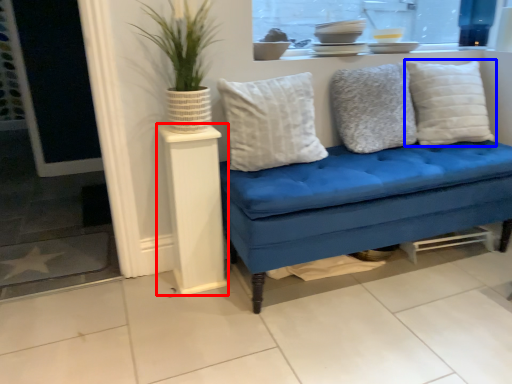
Question: Among these objects, which one is nearest to the camera, side table (highlighted by a red box) or pillow (highlighted by a blue box)?

Choices:
 (A) side table
 (B) pillow

Answer: (A)